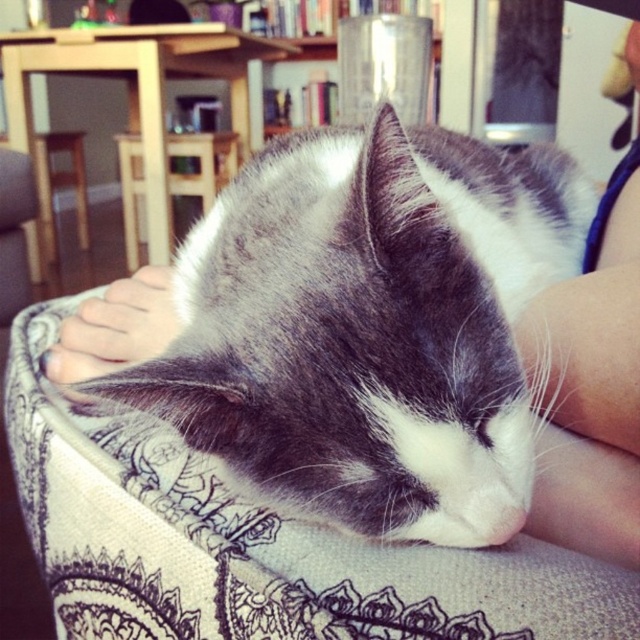
Question: Does skinny white leg at lower right have a smaller size compared to metallic silver bookshelf at upper center?

Choices:
 (A) yes
 (B) no

Answer: (A)

Question: Can you confirm if patterned fabric couch at center is wider than metallic silver bookshelf at upper center?

Choices:
 (A) yes
 (B) no

Answer: (B)

Question: Among these points, which one is nearest to the camera?

Choices:
 (A) (337, 134)
 (B) (145, 550)

Answer: (B)

Question: Estimate the real-world distances between objects in this image. Which object is farther from the metallic silver bookshelf at upper center?

Choices:
 (A) skinny white leg at lower right
 (B) patterned fabric couch at center
 (C) gray-white fur cat at center

Answer: (B)

Question: Which of the following is the farthest from the observer?

Choices:
 (A) (291, 10)
 (B) (116, 552)
 (C) (582, 381)
 (D) (244, 397)

Answer: (A)

Question: Is gray-white fur cat at center below skinny white leg at lower right?

Choices:
 (A) no
 (B) yes

Answer: (A)